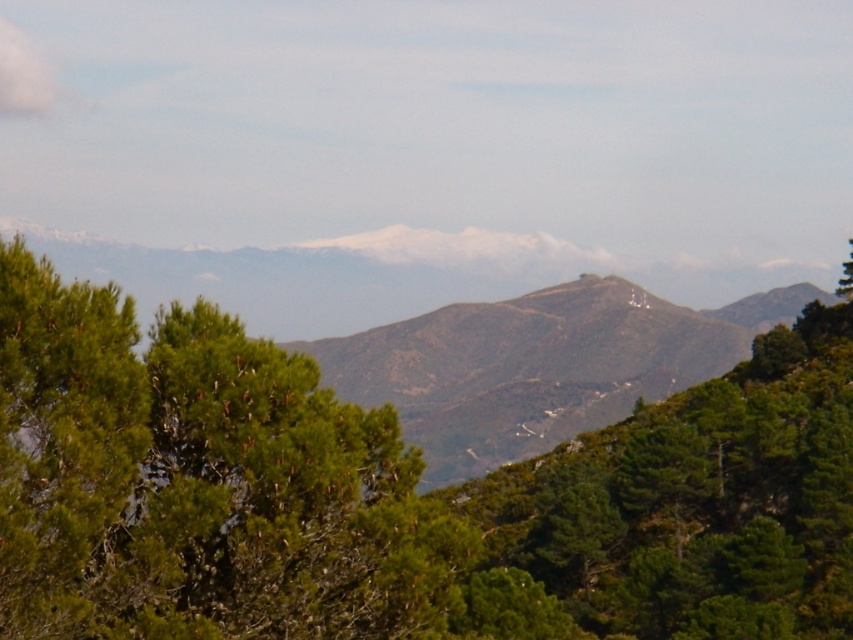
You are standing at the bottom of the mountain and want to take a photo of the green leafy tree at center. If you move 0.1 units to the right and 0.05 units up from your current position, will you still be able to see the tree in the frame?

The green leafy tree at center is located at point (396, 493). Moving 0.1 units to the right and 0.05 units up would adjust your position, but since the tree is at a fixed coordinate, it should remain visible as long as the camera frame encompasses that area. However, without knowing the camera frame size or field of view, it is impossible to definitively confirm visibility. The question might require additional information about the camera setup.

You are an observer standing at the base of the green leafy tree at center. Looking towards the green leafy tree at upper right, which direction would you face to see it?

The green leafy tree at upper right is positioned above the green leafy tree at center, so you would look upwards to see it.